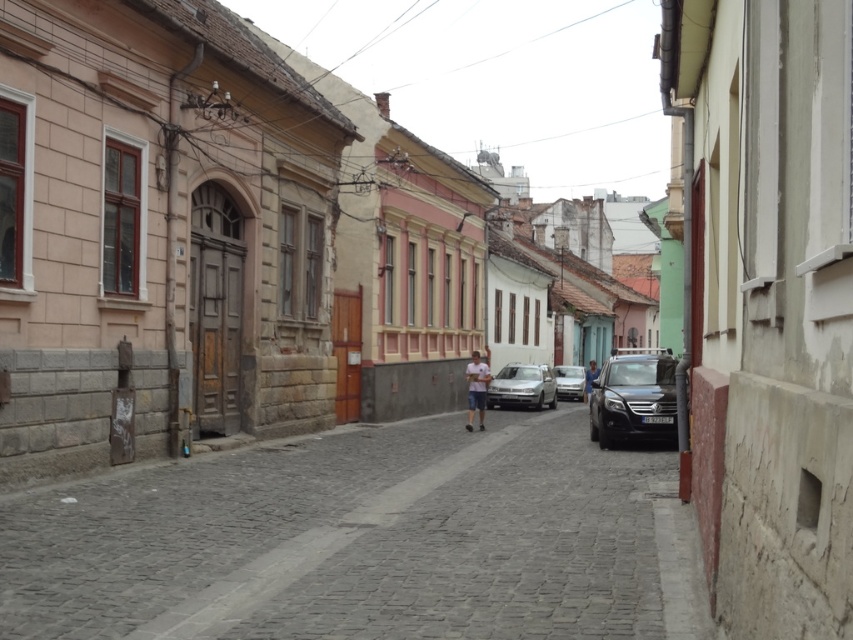
Based on the photo, you are a delivery driver navigating a narrow cobblestone street in a quaint European town. Your GPS indicates you need to park your vehicle exactly 25 meters away from the gray cobblestone street at center. You currently see the silver metallic sedan at center parked on the street. Can you safely park your vehicle at this location to meet the GPS requirement?

The distance between the gray cobblestone street at center and the silver metallic sedan at center is 23.81 meters. Since the GPS requires parking 25 meters away from the gray cobblestone street at center, the current location of the silver metallic sedan at center is too close. You need to move approximately 1.19 meters further away to meet the requirement.

Looking at this image, you are a delivery driver needing to park your vehicle in this narrow street. You see a shiny black suv at center and a silver metallic sedan at center. Which vehicle should you avoid parking next to if you want to stay on the left side of the street?

You should avoid parking next to the shiny black suv at center because it is positioned on the right side of the silver metallic sedan at center, meaning it is already on the right side of the street. Parking next to it would place you on the right side as well, contrary to your intention.

You are standing at the point marked as point [347,541] in the image. Which object are you standing on?

You are standing on the gray cobblestone street at center.